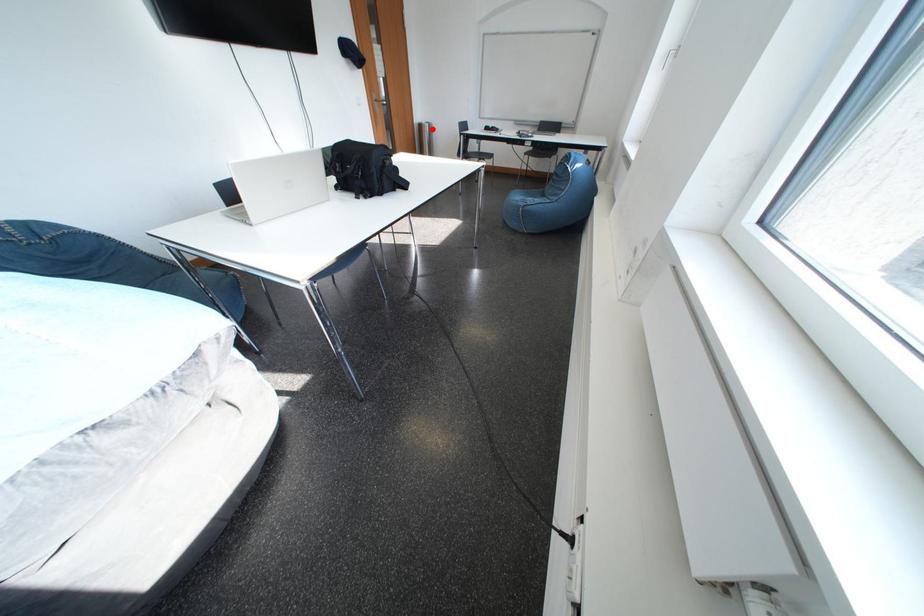
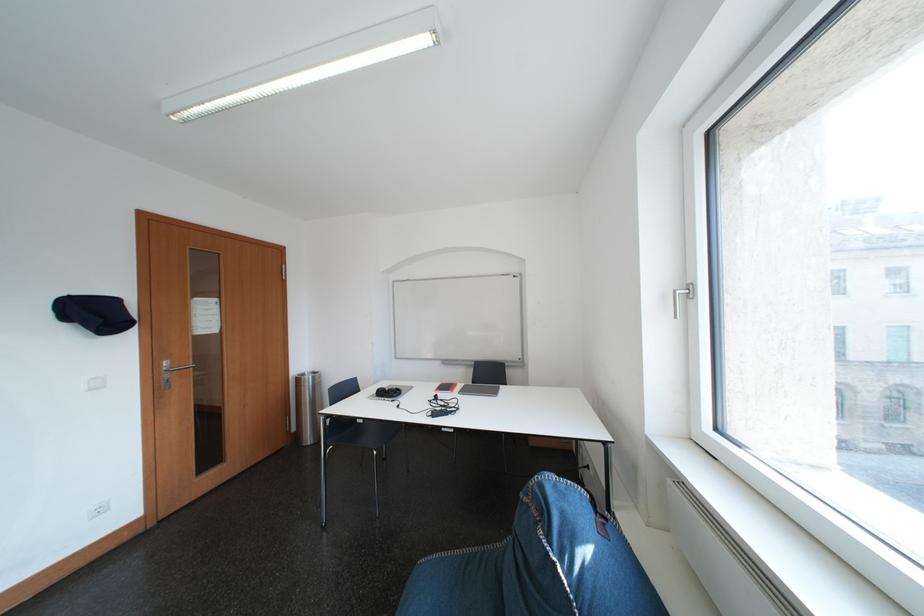
Question: I am providing you with two images of the same scene from different viewpoints. A red point is shown in image1. For the corresponding object point in image2, is it positioned nearer or farther from the camera?

Choices:
 (A) Nearer
 (B) Farther

Answer: (B)